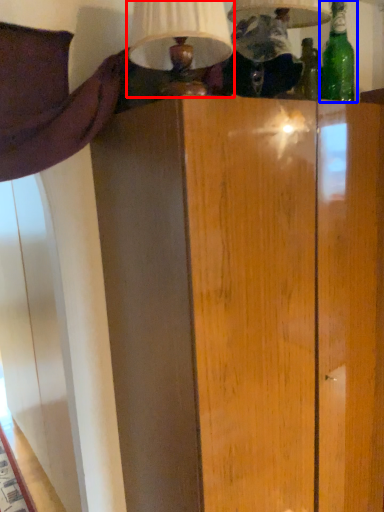
Question: Which of the following is the closest to the observer, table lamp (highlighted by a red box) or bottle (highlighted by a blue box)?

Choices:
 (A) table lamp
 (B) bottle

Answer: (A)